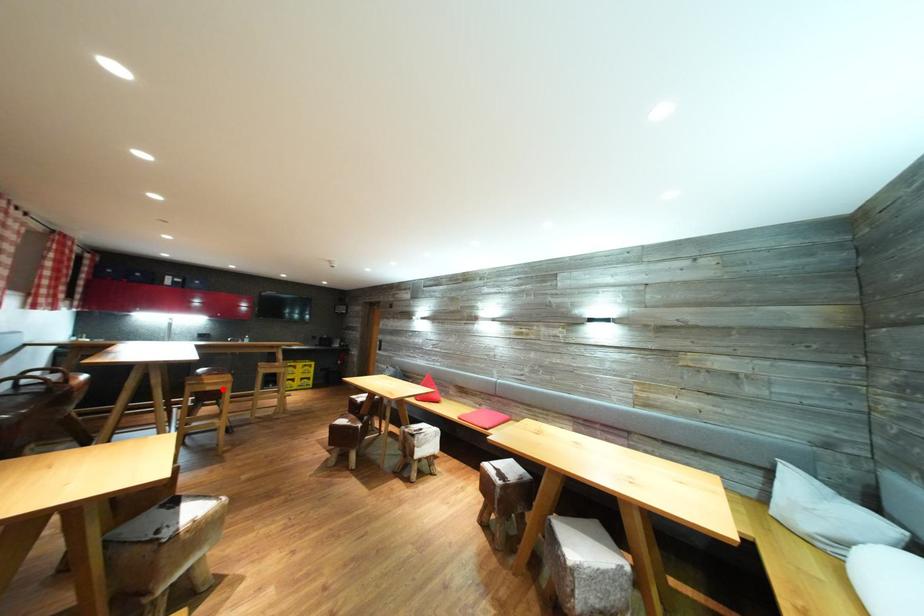
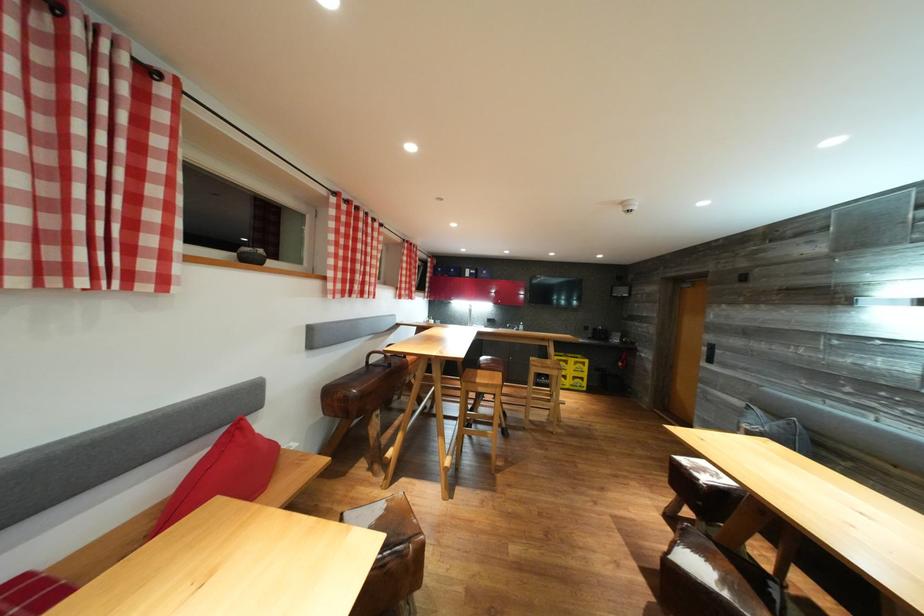
Locate, in the second image, the point that corresponds to the highlighted location in the first image.

(492, 391)